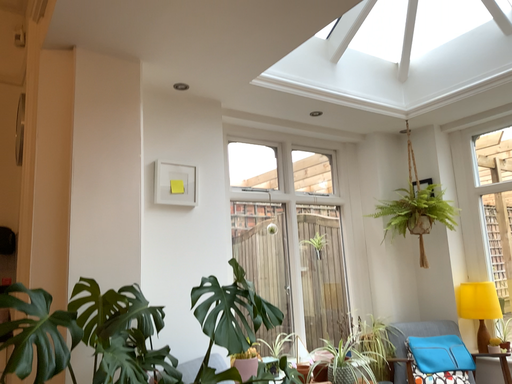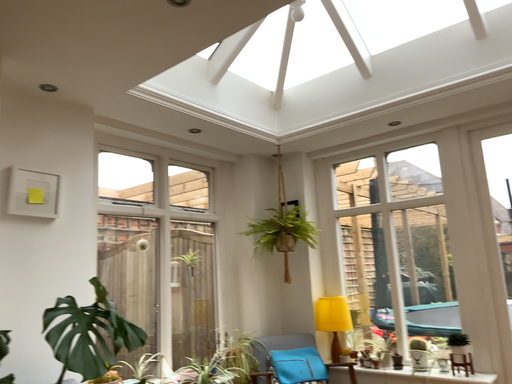
Question: How did the camera likely rotate when shooting the video?

Choices:
 (A) rotated left
 (B) rotated right

Answer: (B)